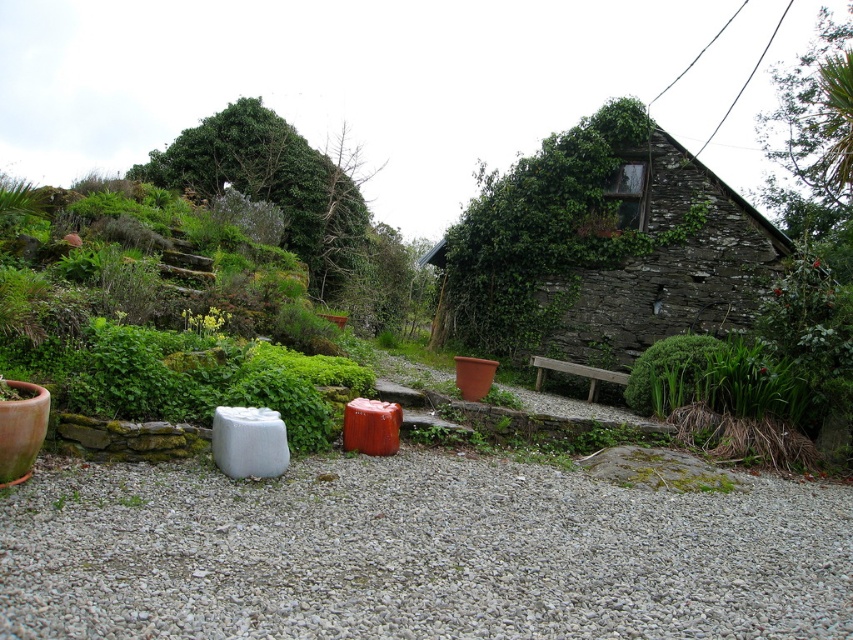
You are standing at the entrance of the stone house and want to walk towards the gray gravel at center. According to the image, in which direction should you move relative to your current position?

The gray gravel at center is located at point 0.864 on the x axis and 0.489 on the y axis. Since you are at the entrance of the stone house, you should move towards the center of the image to reach the gray gravel at center.